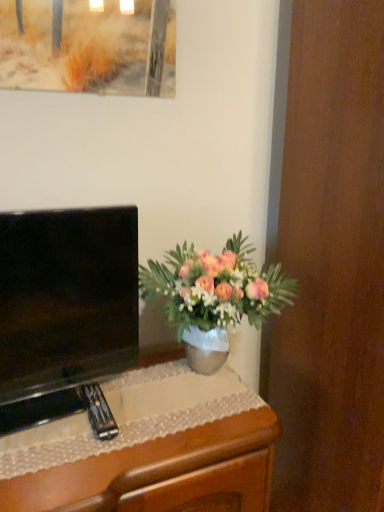
Question: From a real-world perspective, is black glossy television at left positioned above or below pink matte vase at center?

Choices:
 (A) below
 (B) above

Answer: (B)

Question: Considering the relative positions of black glossy television at left and pink matte vase at center in the image provided, is black glossy television at left to the left or to the right of pink matte vase at center?

Choices:
 (A) right
 (B) left

Answer: (B)

Question: Estimate the real-world distances between objects in this image. Which object is closer to the wooden desk at lower left?

Choices:
 (A) black glossy television at left
 (B) pink matte vase at center

Answer: (A)

Question: Considering the real-world distances, which object is farthest from the black glossy television at left?

Choices:
 (A) wooden desk at lower left
 (B) pink matte vase at center

Answer: (B)